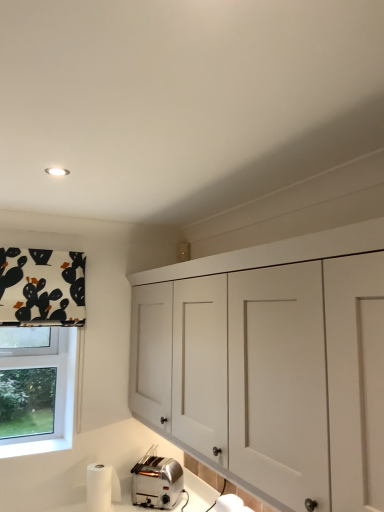
Question: Is satin silver toaster at lower left to the right of white fabric with black and orange shapes at upper left from the viewer's perspective?

Choices:
 (A) yes
 (B) no

Answer: (A)

Question: Could you tell me if satin silver toaster at lower left is turned towards white fabric with black and orange shapes at upper left?

Choices:
 (A) no
 (B) yes

Answer: (A)

Question: From the image's perspective, is satin silver toaster at lower left below white fabric with black and orange shapes at upper left?

Choices:
 (A) no
 (B) yes

Answer: (B)

Question: Is satin silver toaster at lower left smaller than white fabric with black and orange shapes at upper left?

Choices:
 (A) yes
 (B) no

Answer: (A)

Question: Is satin silver toaster at lower left wider than white fabric with black and orange shapes at upper left?

Choices:
 (A) yes
 (B) no

Answer: (A)

Question: Considering the positions of white fabric with black and orange shapes at upper left and white matte cabinet at upper center in the image, is white fabric with black and orange shapes at upper left wider or thinner than white matte cabinet at upper center?

Choices:
 (A) wide
 (B) thin

Answer: (B)

Question: Do you think white fabric with black and orange shapes at upper left is within white matte cabinet at upper center, or outside of it?

Choices:
 (A) inside
 (B) outside

Answer: (B)

Question: In terms of height, does white fabric with black and orange shapes at upper left look taller or shorter compared to white matte cabinet at upper center?

Choices:
 (A) tall
 (B) short

Answer: (B)

Question: Based on their positions, is white fabric with black and orange shapes at upper left located to the left or right of white matte cabinet at upper center?

Choices:
 (A) right
 (B) left

Answer: (B)

Question: Relative to white matte cabinet at upper center, is satin silver toaster at lower left in front or behind?

Choices:
 (A) front
 (B) behind

Answer: (B)

Question: In the image, is satin silver toaster at lower left on the left side or the right side of white matte cabinet at upper center?

Choices:
 (A) right
 (B) left

Answer: (B)

Question: Is point (150, 470) closer or farther from the camera than point (337, 408)?

Choices:
 (A) farther
 (B) closer

Answer: (A)

Question: Looking at the image, does satin silver toaster at lower left seem bigger or smaller compared to white matte cabinet at upper center?

Choices:
 (A) small
 (B) big

Answer: (A)

Question: Based on their positions, is white matte cabinet at upper center located to the left or right of satin silver toaster at lower left?

Choices:
 (A) right
 (B) left

Answer: (A)

Question: From their relative heights in the image, would you say white matte cabinet at upper center is taller or shorter than satin silver toaster at lower left?

Choices:
 (A) short
 (B) tall

Answer: (B)